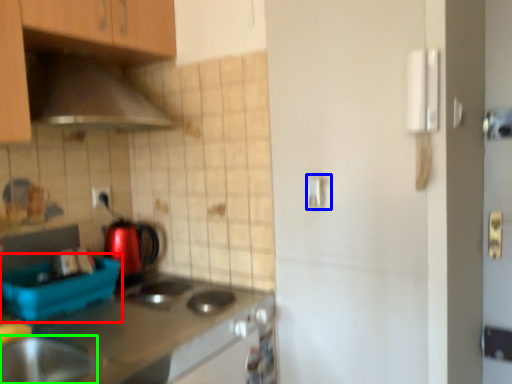
Question: Which object is the closest to the appliance (highlighted by a red box)? Choose among these: door handle (highlighted by a blue box) or home appliance (highlighted by a green box).

Choices:
 (A) door handle
 (B) home appliance

Answer: (B)